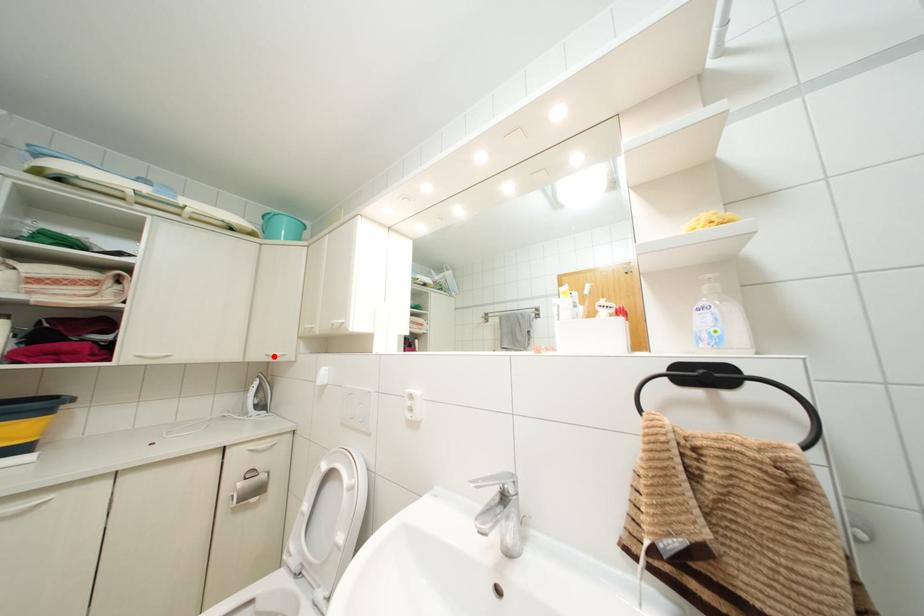
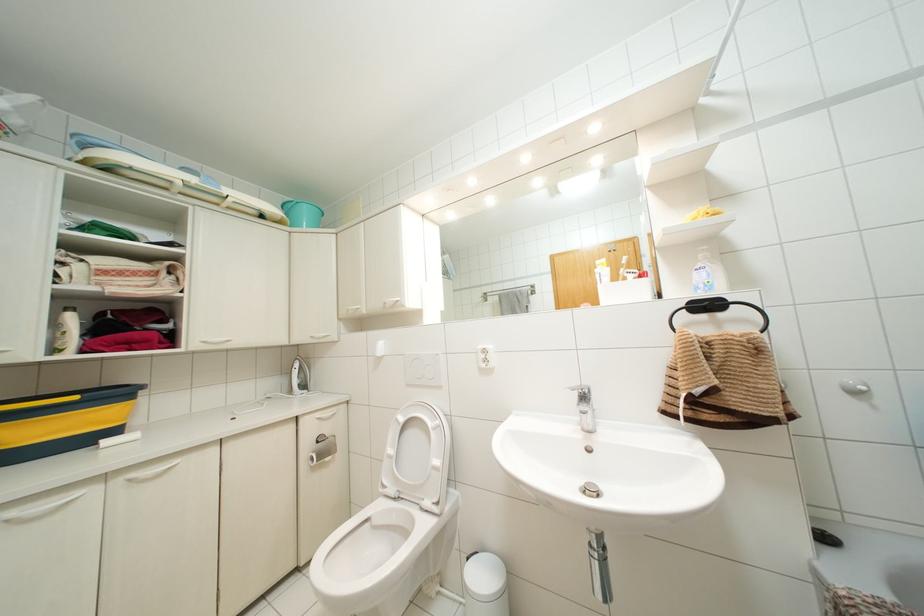
Find the pixel in the second image that matches the highlighted location in the first image.

(319, 338)